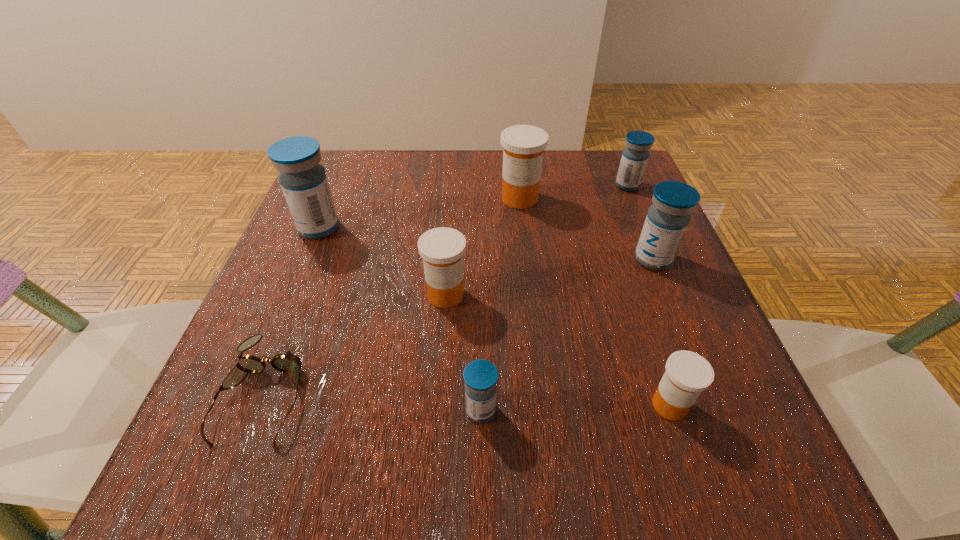
Where is `the second blue medicine from left to right`? the second blue medicine from left to right is located at coordinates (480, 376).

Locate an element on the screen. the nearest orange medicine is located at coordinates (687, 374).

Identify the location of the smallest orange medicine. The image size is (960, 540). (687, 374).

Find the location of `the shortest object`. the shortest object is located at coordinates (288, 363).

Identify the location of vacant space located on the right of the tallest medicine. Image resolution: width=960 pixels, height=540 pixels. (501, 228).

You are a GUI agent. You are given a task and a screenshot of the screen. Output one action in this format:
    pyautogui.click(x=<x>, y=<y>)
    Task: Click on the vacant space located on the label of the fourth medicine from left to right
    This screenshot has height=540, width=960.
    Given the screenshot: What is the action you would take?
    [x=526, y=255]

I want to click on vacant space located on the back of the second nearest blue medicine, so click(620, 179).

The width and height of the screenshot is (960, 540). I want to click on free region located on the label of the fifth farthest medicine, so click(443, 335).

The width and height of the screenshot is (960, 540). What are the coordinates of `free spot located on the left of the third biggest blue medicine` in the screenshot? It's located at (527, 185).

Image resolution: width=960 pixels, height=540 pixels. I want to click on vacant space located on the back of the second blue medicine from left to right, so click(x=481, y=248).